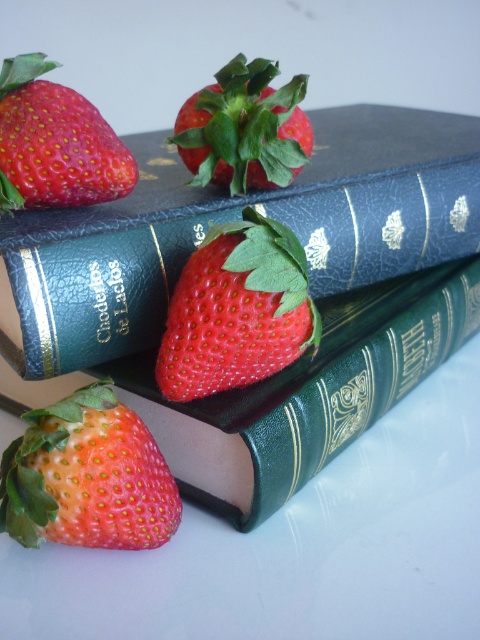
You are organizing a picnic basket and want to fit both the shiny red strawberry at lower left and the shiny red strawberry at center. If the basket has a compartment that can only hold the smaller strawberry, which one should you place there?

The shiny red strawberry at lower left is smaller than the shiny red strawberry at center, so you should place the shiny red strawberry at lower left in the compartment.